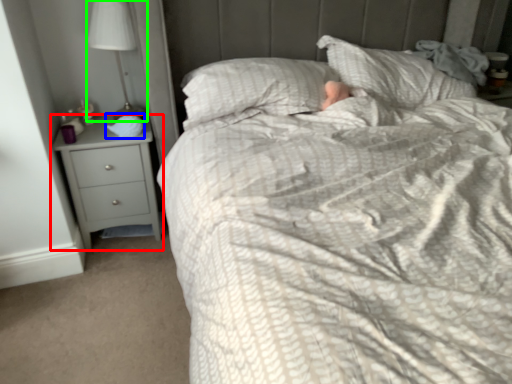
Question: Estimate the real-world distances between objects in this image. Which object is closer to chest of drawers (highlighted by a red box), sleeping bag (highlighted by a blue box) or lamp (highlighted by a green box)?

Choices:
 (A) sleeping bag
 (B) lamp

Answer: (A)